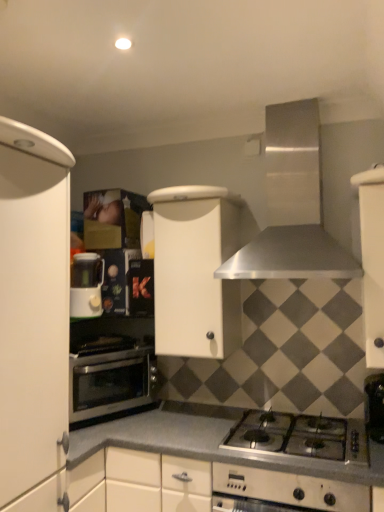
Question: Can you confirm if white matte cabinet at right, which is the first cabinetry from right to left, is bigger than white plastic coffee machine at left?

Choices:
 (A) no
 (B) yes

Answer: (B)

Question: Is white matte cabinet at right, which is the first cabinetry from right to left, positioned with its back to white plastic coffee machine at left?

Choices:
 (A) yes
 (B) no

Answer: (B)

Question: From the image's perspective, does white matte cabinet at right, which is the first cabinetry from right to left, appear higher than white plastic coffee machine at left?

Choices:
 (A) no
 (B) yes

Answer: (B)

Question: Is white matte cabinet at right, marked as the 3th cabinetry in a left-to-right arrangement, at the right side of white plastic coffee machine at left?

Choices:
 (A) yes
 (B) no

Answer: (A)

Question: Could you tell me if white matte cabinet at right, which is the first cabinetry from right to left, is turned towards white plastic coffee machine at left?

Choices:
 (A) no
 (B) yes

Answer: (A)

Question: From a real-world perspective, is white matte cabinet at right, which is the first cabinetry from right to left, over white plastic coffee machine at left?

Choices:
 (A) no
 (B) yes

Answer: (B)

Question: Is white plastic coffee machine at left placed right next to white matte cabinet at right, which is the first cabinetry from right to left?

Choices:
 (A) yes
 (B) no

Answer: (B)

Question: Does white plastic coffee machine at left have a lesser width compared to white matte cabinet at right, marked as the 3th cabinetry in a left-to-right arrangement?

Choices:
 (A) yes
 (B) no

Answer: (A)

Question: Is the position of white plastic coffee machine at left less distant than that of white matte cabinet at right, marked as the 3th cabinetry in a left-to-right arrangement?

Choices:
 (A) no
 (B) yes

Answer: (A)

Question: From a real-world perspective, is white plastic coffee machine at left located beneath white matte cabinet at right, which is the first cabinetry from right to left?

Choices:
 (A) no
 (B) yes

Answer: (B)

Question: Does white plastic coffee machine at left have a greater width compared to white matte cabinet at right, marked as the 3th cabinetry in a left-to-right arrangement?

Choices:
 (A) yes
 (B) no

Answer: (B)

Question: Can you confirm if white plastic coffee machine at left is taller than white matte cabinet at right, which is the first cabinetry from right to left?

Choices:
 (A) no
 (B) yes

Answer: (A)

Question: From the image's perspective, would you say stainless steel oven at lower left is shown under white matte cabinet at center, placed as the 2th cabinetry when sorted from left to right?

Choices:
 (A) yes
 (B) no

Answer: (A)